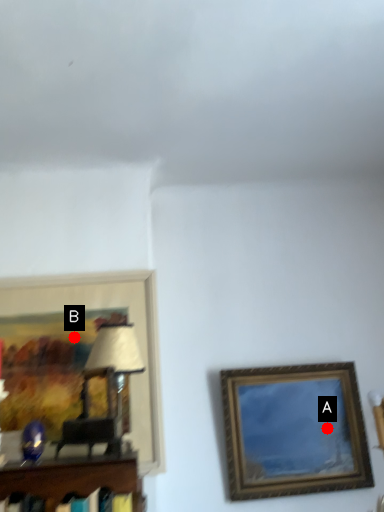
Question: Two points are circled on the image, labeled by A and B beside each circle. Which point is farther to the camera?

Choices:
 (A) A is further
 (B) B is further

Answer: (A)